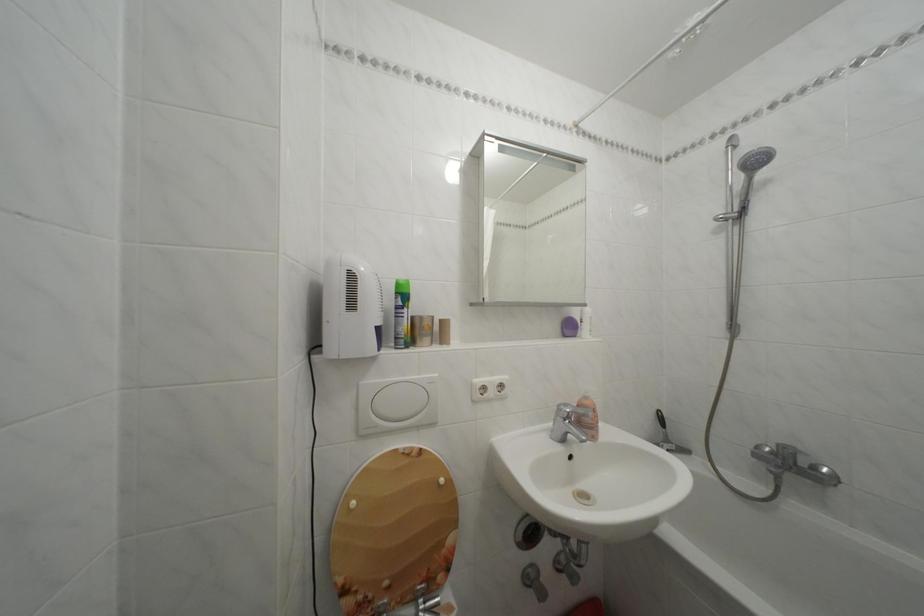
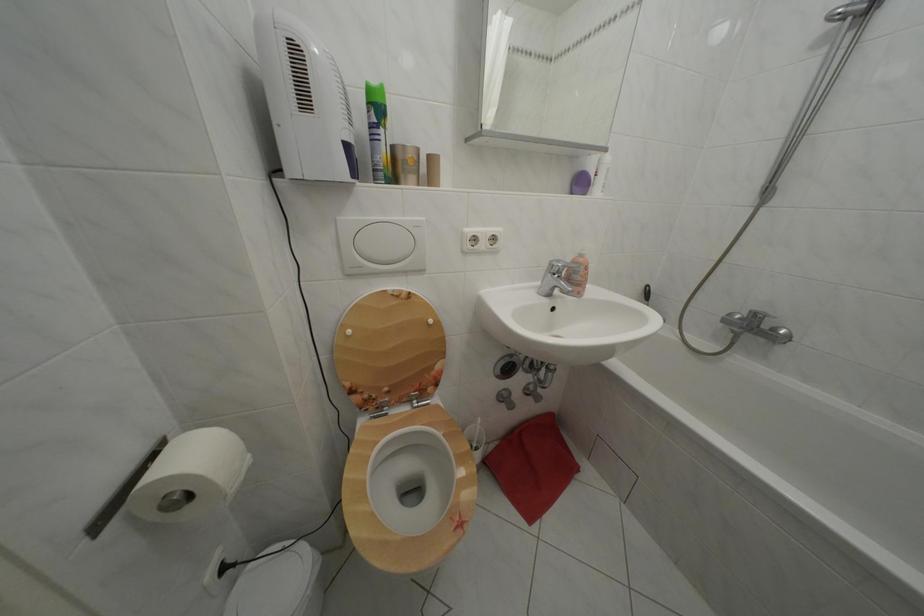
In the second image, find the point that corresponds to pixel 822 475 in the first image.

(783, 336)